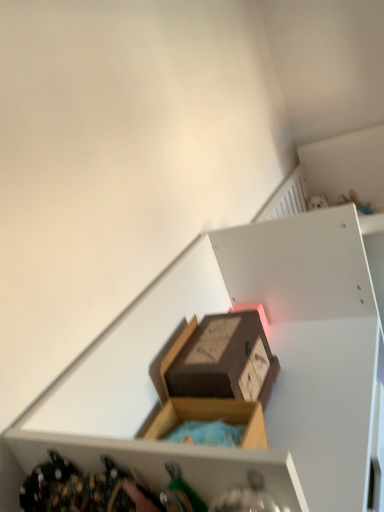
Question: Is wooden box at upper center shorter than matte brown box at center?

Choices:
 (A) no
 (B) yes

Answer: (A)

Question: Does wooden box at upper center have a greater height compared to matte brown box at center?

Choices:
 (A) yes
 (B) no

Answer: (A)

Question: Does wooden box at upper center have a smaller size compared to matte brown box at center?

Choices:
 (A) yes
 (B) no

Answer: (B)

Question: Is there a large distance between wooden box at upper center and matte brown box at center?

Choices:
 (A) yes
 (B) no

Answer: (B)

Question: Does wooden box at upper center lie in front of matte brown box at center?

Choices:
 (A) yes
 (B) no

Answer: (A)

Question: Is wooden box at upper center to the left of matte brown box at center from the viewer's perspective?

Choices:
 (A) no
 (B) yes

Answer: (A)

Question: From the image's perspective, is matte brown box at center located beneath wooden box at upper center?

Choices:
 (A) no
 (B) yes

Answer: (A)

Question: From the image's perspective, would you say matte brown box at center is positioned over wooden box at upper center?

Choices:
 (A) yes
 (B) no

Answer: (A)

Question: Is matte brown box at center shorter than wooden box at upper center?

Choices:
 (A) yes
 (B) no

Answer: (A)

Question: Is matte brown box at center positioned beyond the bounds of wooden box at upper center?

Choices:
 (A) no
 (B) yes

Answer: (A)

Question: Is matte brown box at center smaller than wooden box at upper center?

Choices:
 (A) yes
 (B) no

Answer: (A)

Question: Is matte brown box at center behind wooden box at upper center?

Choices:
 (A) no
 (B) yes

Answer: (B)

Question: Considering the relative positions of matte brown box at center and wooden box at upper center in the image provided, is matte brown box at center to the left or to the right of wooden box at upper center?

Choices:
 (A) left
 (B) right

Answer: (A)